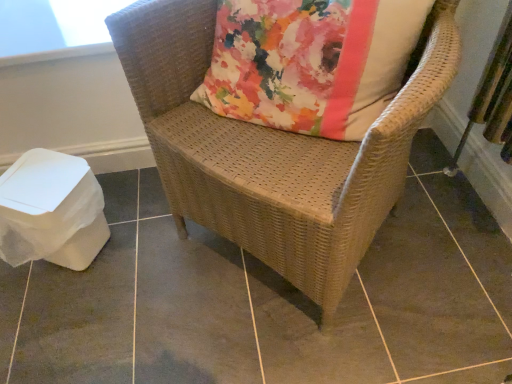
Question: Is woven wicker chair at center wider or thinner than brown woven chair at center?

Choices:
 (A) wide
 (B) thin

Answer: (B)

Question: Does point (231, 221) appear closer or farther from the camera than point (20, 274)?

Choices:
 (A) farther
 (B) closer

Answer: (B)

Question: Which is farther from the woven wicker chair at center?

Choices:
 (A) transparent plastic window screen at upper left
 (B) brown woven chair at center

Answer: (A)

Question: Which object is the farthest from the woven wicker chair at center?

Choices:
 (A) transparent plastic window screen at upper left
 (B) brown woven chair at center

Answer: (A)